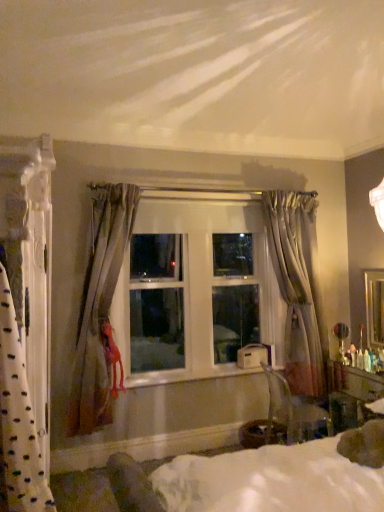
Question: Is white textured curtain at left, which is counted as the first curtain, starting from the left, far from transparent plastic chair at lower right?

Choices:
 (A) yes
 (B) no

Answer: (A)

Question: From the image's perspective, would you say white textured curtain at left, the first curtain viewed from the front, is shown under transparent plastic chair at lower right?

Choices:
 (A) no
 (B) yes

Answer: (A)

Question: Is transparent plastic chair at lower right a part of white textured curtain at left, which is counted as the first curtain, starting from the left?

Choices:
 (A) no
 (B) yes

Answer: (A)

Question: Is white textured curtain at left, which appears as the 3th curtain when viewed from the back, facing away from transparent plastic chair at lower right?

Choices:
 (A) yes
 (B) no

Answer: (B)

Question: From a real-world perspective, is white textured curtain at left, which appears as the third curtain when viewed from the right, located beneath transparent plastic chair at lower right?

Choices:
 (A) yes
 (B) no

Answer: (B)

Question: From a real-world perspective, is silver metallic mirror at right physically located above or below silky beige curtain at center, which appears as the second curtain when viewed from the back?

Choices:
 (A) above
 (B) below

Answer: (B)

Question: In terms of height, does silver metallic mirror at right look taller or shorter compared to silky beige curtain at center, which appears as the second curtain when viewed from the back?

Choices:
 (A) tall
 (B) short

Answer: (B)

Question: Which is correct: silver metallic mirror at right is inside silky beige curtain at center, which appears as the second curtain when viewed from the front, or outside of it?

Choices:
 (A) inside
 (B) outside

Answer: (B)

Question: Considering the positions of silver metallic mirror at right and silky beige curtain at center, which appears as the second curtain when viewed from the back, in the image, is silver metallic mirror at right bigger or smaller than silky beige curtain at center, which appears as the second curtain when viewed from the back,?

Choices:
 (A) small
 (B) big

Answer: (A)

Question: From a real-world perspective, is metallic silver table lamp at right above or below silver metallic mirror at right?

Choices:
 (A) below
 (B) above

Answer: (A)

Question: From the image's perspective, is metallic silver table lamp at right positioned above or below silver metallic mirror at right?

Choices:
 (A) above
 (B) below

Answer: (B)

Question: Considering their positions, is metallic silver table lamp at right located in front of or behind silver metallic mirror at right?

Choices:
 (A) front
 (B) behind

Answer: (A)

Question: Is metallic silver table lamp at right taller or shorter than silver metallic mirror at right?

Choices:
 (A) short
 (B) tall

Answer: (A)

Question: Considering the positions of silky beige curtain at center, which appears as the second curtain when viewed from the front, and white fabric bed at center in the image, is silky beige curtain at center, which appears as the second curtain when viewed from the front, taller or shorter than white fabric bed at center?

Choices:
 (A) short
 (B) tall

Answer: (B)

Question: Would you say silky beige curtain at center, placed as the 2th curtain when sorted from left to right, is to the left or to the right of white fabric bed at center in the picture?

Choices:
 (A) left
 (B) right

Answer: (A)